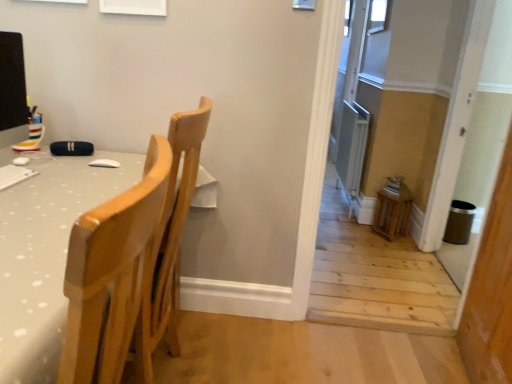
Question: From the image's perspective, is clear glass window at upper right, the 2th window positioned from the back, located above or below transparent glass window at upper center, the first window in the right-to-left sequence?

Choices:
 (A) above
 (B) below

Answer: (B)

Question: Based on their sizes in the image, would you say clear glass window at upper right, the second window when ordered from top to bottom, is bigger or smaller than transparent glass window at upper center, the second window from the bottom?

Choices:
 (A) big
 (B) small

Answer: (B)

Question: Which is farther from the clear glass window at upper right, the 2th window positioned from the back?

Choices:
 (A) matte black monitor at left
 (B) light wood chair at left
 (C) metallic silver screen door at right
 (D) transparent glass window at upper center, which is the second window from front to back

Answer: (B)

Question: Which object is the closest to the metallic silver screen door at right?

Choices:
 (A) light wood chair at left
 (B) matte black monitor at left
 (C) transparent glass window at upper center, which appears as the first window when viewed from the back
 (D) clear glass window at upper right, placed as the 2th window when sorted from right to left

Answer: (A)